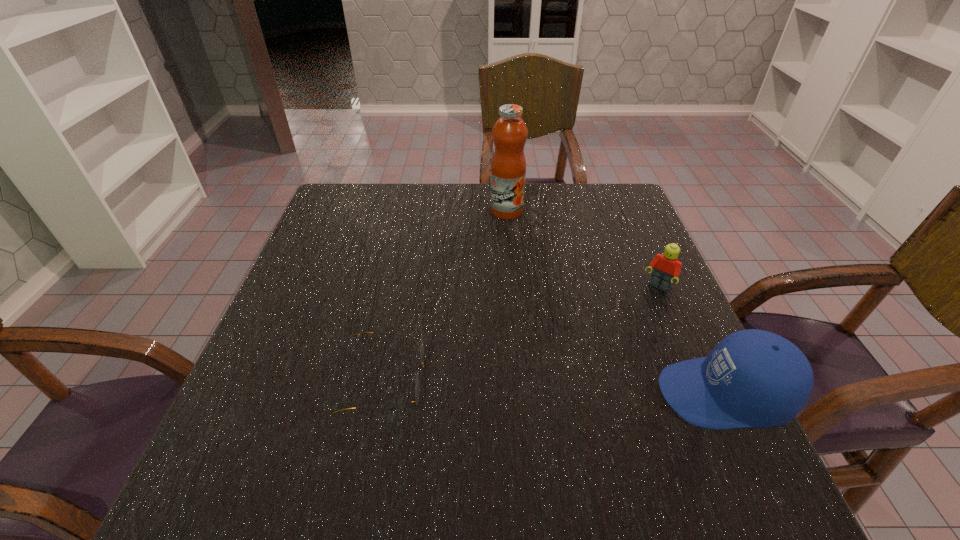
At what (x,y) coordinates should I click in order to perform the action: click on free space on the desktop that is between the leftmost object and the cap and is positioned on the front label of the third object from right to left. Please return your answer as a coordinate pair (x, y). The width and height of the screenshot is (960, 540). Looking at the image, I should click on (586, 388).

Identify the location of free space on the desktop that is between the spectacles and the cap and is positioned on the face of the Lego. Image resolution: width=960 pixels, height=540 pixels. (585, 388).